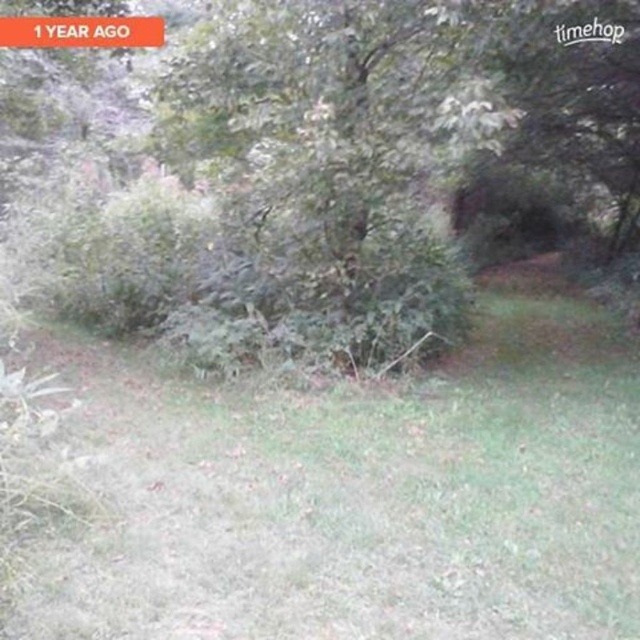
You are standing in the garden and see the green grass at center and the green leafy tree at center. Which object is positioned to the left?

The green grass at center is to the left of the green leafy tree at center, so the green grass at center is positioned to the left.